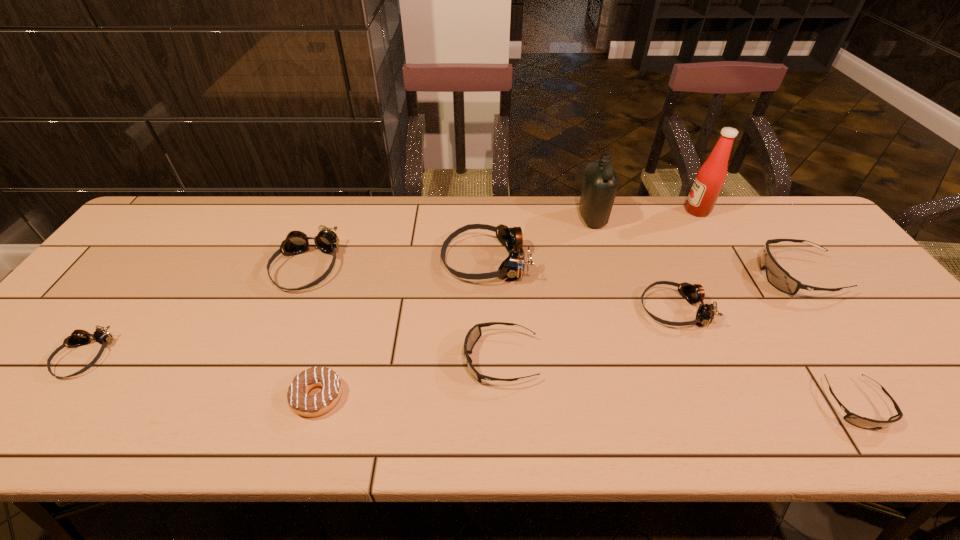
Where is `the fifth closest goggles to the leftmost goggles`? Image resolution: width=960 pixels, height=540 pixels. the fifth closest goggles to the leftmost goggles is located at coordinates (862, 422).

Identify which bronze goggles is located as the fourth nearest to the chocolate doughnut. Please provide its 2D coordinates. Your answer should be formatted as a tuple, i.e. [(x, y)], where the tuple contains the x and y coordinates of a point satisfying the conditions above.

[(694, 293)]

Locate which bronze goggles ranks second in proximity to the tallest goggles. Please provide its 2D coordinates. Your answer should be formatted as a tuple, i.e. [(x, y)], where the tuple contains the x and y coordinates of a point satisfying the conditions above.

[(296, 242)]

Where is `black goggles that is the second closest to the nearest bronze goggles`? The image size is (960, 540). black goggles that is the second closest to the nearest bronze goggles is located at coordinates (862, 422).

Find the location of a particular element. This screenshot has width=960, height=540. the third closest black goggles to the second biggest bronze goggles is located at coordinates (862, 422).

Locate an element on the screen. vacant region that satisfies the following two spatial constraints: 1. on the lenses of the biggest black goggles; 2. on the lenses of the smallest black goggles is located at coordinates (890, 404).

Find the location of a particular element. free space that satisfies the following two spatial constraints: 1. on the front-facing side of the condiment; 2. on the front side of the second tallest object is located at coordinates (701, 218).

Identify the location of vacant space that satisfies the following two spatial constraints: 1. on the lenses of the farthest black goggles; 2. through the lenses of the smallest bronze goggles. (855, 357).

You are a GUI agent. You are given a task and a screenshot of the screen. Output one action in this format:
    pyautogui.click(x=<x>, y=<y>)
    Task: Click on the vacant space that satisfies the following two spatial constraints: 1. on the front-facing side of the red condiment; 2. through the lenses of the nearest bronze goggles
    This screenshot has height=540, width=960.
    Given the screenshot: What is the action you would take?
    (x=781, y=357)